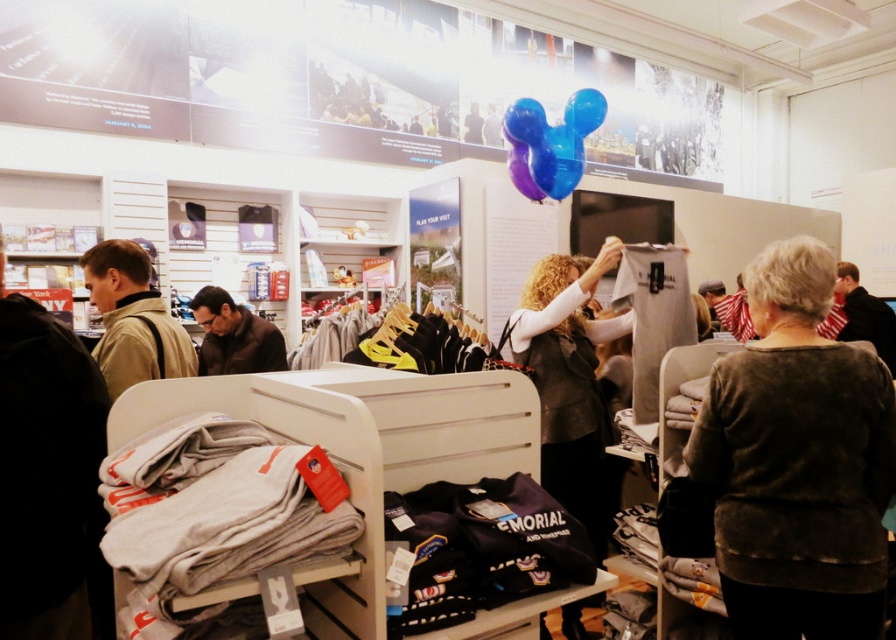
The width and height of the screenshot is (896, 640). I want to click on black leather jacket at center, so click(x=569, y=378).

Can you confirm if black leather jacket at center is shorter than brown leather jacket at lower left?

No.

Is point (579, 449) positioned before point (225, 333)?

Yes, point (579, 449) is closer to viewer.

The width and height of the screenshot is (896, 640). Identify the location of black leather jacket at center. (569, 378).

Who is more distant from viewer, (553, 193) or (268, 339)?

Positioned behind is point (553, 193).

Between translucent blue balloon at upper center and brown leather jacket at lower left, which one is positioned lower?

brown leather jacket at lower left is lower down.

The width and height of the screenshot is (896, 640). What do you see at coordinates (550, 144) in the screenshot? I see `translucent blue balloon at upper center` at bounding box center [550, 144].

Locate an element on the screen. The width and height of the screenshot is (896, 640). translucent blue balloon at upper center is located at coordinates (550, 144).

What do you see at coordinates (797, 461) in the screenshot? I see `dark gray sweater at center` at bounding box center [797, 461].

Who is shorter, dark gray sweater at center or translucent blue balloon at upper center?

translucent blue balloon at upper center is shorter.

Locate an element on the screen. The height and width of the screenshot is (640, 896). dark gray sweater at center is located at coordinates (797, 461).

At what (x,y) coordinates should I click in order to perform the action: click on dark gray sweater at center. Please return your answer as a coordinate pair (x, y). This screenshot has height=640, width=896. Looking at the image, I should click on (797, 461).